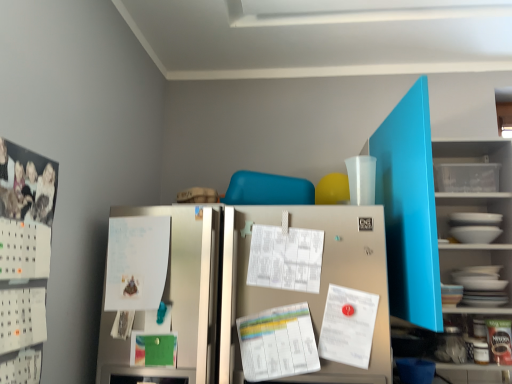
What are the coordinates of `white paper at center, the 2th paper from the left` in the screenshot? It's located at (285, 258).

I want to click on white paperboard at left, so click(x=24, y=258).

What do you see at coordinates (473, 258) in the screenshot? I see `white glossy bowls at right` at bounding box center [473, 258].

Describe the element at coordinates (348, 326) in the screenshot. I see `white paper at center, placed as the 3th paper when sorted from left to right` at that location.

Where is `satin silver refrigerator at center`? The image size is (512, 384). satin silver refrigerator at center is located at coordinates (257, 289).

Is white paper at center, the 2th paper from the left, next to satin silver refrigerator at center and touching it?

No, white paper at center, the 2th paper from the left, is not making contact with satin silver refrigerator at center.

Based on the photo, how much distance is there between white paper at center, which appears as the second paper when viewed from the right, and satin silver refrigerator at center?

A distance of 5.33 inches exists between white paper at center, which appears as the second paper when viewed from the right, and satin silver refrigerator at center.

Between white paper at center, the 2th paper from the left, and satin silver refrigerator at center, which one appears on the right side from the viewer's perspective?

Positioned to the right is white paper at center, the 2th paper from the left.

From a real-world perspective, which object stands above the other?

white paper at center, the 2th paper from the left, from a real-world perspective.

From the image's perspective, would you say satin silver refrigerator at center is positioned over white paperboard at left?

No, from the image's perspective, satin silver refrigerator at center is not over white paperboard at left.

Between satin silver refrigerator at center and white paperboard at left, which one has less height?

white paperboard at left is shorter.

In the image, is satin silver refrigerator at center positioned in front of or behind white paperboard at left?

satin silver refrigerator at center is positioned farther from the viewer than white paperboard at left.

How distant is satin silver refrigerator at center from white paperboard at left?

satin silver refrigerator at center is 19.11 inches away from white paperboard at left.

This screenshot has width=512, height=384. In order to click on bulletin board that is on the left side of matte blue bookshelf at upper right in this screenshot , I will do `click(24, 258)`.

Can you tell me how much white paperboard at left and matte blue bookshelf at upper right differ in facing direction?

90.2 degrees.

Considering the positions of objects white paperboard at left and matte blue bookshelf at upper right in the image provided, who is more to the right, white paperboard at left or matte blue bookshelf at upper right?

Positioned to the right is matte blue bookshelf at upper right.

In the scene shown: Is white paperboard at left touching matte blue bookshelf at upper right?

white paperboard at left and matte blue bookshelf at upper right are not in contact.

Does white paper at center, which appears as the 3th paper when viewed from the right, turn towards white paperboard at left?

Yes, white paper at center, which appears as the 3th paper when viewed from the right, is turned towards white paperboard at left.

Considering the relative sizes of white paper at center, which appears as the 3th paper when viewed from the right, and white paperboard at left in the image provided, is white paper at center, which appears as the 3th paper when viewed from the right, wider than white paperboard at left?

Indeed, white paper at center, which appears as the 3th paper when viewed from the right, has a greater width compared to white paperboard at left.

Does white paper at center, which appears as the 3th paper when viewed from the right, have a larger size compared to white paperboard at left?

Incorrect, white paper at center, which appears as the 3th paper when viewed from the right, is not larger than white paperboard at left.

Does matte blue bookshelf at upper right have a lesser width compared to satin silver refrigerator at center?

In fact, matte blue bookshelf at upper right might be wider than satin silver refrigerator at center.

Looking at the image, does matte blue bookshelf at upper right seem bigger or smaller compared to satin silver refrigerator at center?

In the image, matte blue bookshelf at upper right appears to be smaller than satin silver refrigerator at center.

Considering their positions, is matte blue bookshelf at upper right located in front of or behind satin silver refrigerator at center?

matte blue bookshelf at upper right is positioned closer to the viewer than satin silver refrigerator at center.

Is matte blue bookshelf at upper right not within satin silver refrigerator at center?

Indeed, matte blue bookshelf at upper right is completely outside satin silver refrigerator at center.

From a real-world perspective, between satin silver refrigerator at center and white glossy bowls at right, who is vertically higher?

white glossy bowls at right.

Consider the image. Can you confirm if satin silver refrigerator at center is taller than white glossy bowls at right?

Answer: Yes, satin silver refrigerator at center is taller than white glossy bowls at right.

Is satin silver refrigerator at center inside the boundaries of white glossy bowls at right, or outside?

satin silver refrigerator at center is not enclosed by white glossy bowls at right.

Is there a large distance between satin silver refrigerator at center and white glossy bowls at right?

satin silver refrigerator at center is actually quite close to white glossy bowls at right.

Consider the image. Considering the sizes of white paper at center, the 2th paper from the left, and white paper at center, which appears as the 3th paper when viewed from the right, in the image, is white paper at center, the 2th paper from the left, wider or thinner than white paper at center, which appears as the 3th paper when viewed from the right,?

Considering their sizes, white paper at center, the 2th paper from the left, looks slimmer than white paper at center, which appears as the 3th paper when viewed from the right.

Is white paper at center, which appears as the second paper when viewed from the right, at the left side of white paper at center, the 1th paper in the left-to-right sequence?

No.

Is white paper at center, which appears as the second paper when viewed from the right, positioned with its back to white paper at center, which appears as the 3th paper when viewed from the right?

That's not correct — white paper at center, which appears as the second paper when viewed from the right, is not looking away from white paper at center, which appears as the 3th paper when viewed from the right.

Does white paper at center, the 2th paper from the left, have a smaller size compared to white paper at center, the 1th paper in the left-to-right sequence?

Yes, white paper at center, the 2th paper from the left, is smaller than white paper at center, the 1th paper in the left-to-right sequence.

Locate an element on the screen. The image size is (512, 384). the 3rd paper above the satin silver refrigerator at center (from the image's perspective) is located at coordinates [x=285, y=258].

Where is `refrigerator located behind the white paperboard at left`? The height and width of the screenshot is (384, 512). refrigerator located behind the white paperboard at left is located at coordinates (x=257, y=289).

Looking at the image, which one is located closer to white paper at center, marked as the first paper in a right-to-left arrangement, white paper at center, the 2th paper from the left, or satin silver refrigerator at center?

Based on the image, white paper at center, the 2th paper from the left, appears to be nearer to white paper at center, marked as the first paper in a right-to-left arrangement.

Based on their spatial positions, is white paperboard at left or white glossy bowls at right further from white paper at center, placed as the 3th paper when sorted from left to right?

white paperboard at left is positioned further to the anchor white paper at center, placed as the 3th paper when sorted from left to right.

From the image, which object appears to be nearer to white paperboard at left, white paper at center, which appears as the second paper when viewed from the right, or satin silver refrigerator at center?

satin silver refrigerator at center lies closer to white paperboard at left than the other object.

Estimate the real-world distances between objects in this image. Which object is closer to white paper at center, placed as the 3th paper when sorted from left to right, white glossy bowls at right or satin silver refrigerator at center?

Based on the image, satin silver refrigerator at center appears to be nearer to white paper at center, placed as the 3th paper when sorted from left to right.

Based on the photo, based on their spatial positions, is satin silver refrigerator at center or white paper at center, which appears as the second paper when viewed from the right, further from white glossy bowls at right?

Based on the image, satin silver refrigerator at center appears to be further to white glossy bowls at right.

Based on their spatial positions, is white glossy bowls at right or white paperboard at left further from white paper at center, marked as the first paper in a right-to-left arrangement?

white paperboard at left is positioned further to the anchor white paper at center, marked as the first paper in a right-to-left arrangement.

Which object lies nearer to the anchor point matte blue bookshelf at upper right, white paper at center, the 2th paper from the left, or satin silver refrigerator at center?

Based on the image, white paper at center, the 2th paper from the left, appears to be nearer to matte blue bookshelf at upper right.

Looking at the image, which one is located further to white paper at center, which appears as the second paper when viewed from the right, satin silver refrigerator at center or white paperboard at left?

white paperboard at left.

You are a GUI agent. You are given a task and a screenshot of the screen. Output one action in this format:
    pyautogui.click(x=<x>, y=<y>)
    Task: Click on the bookshelf situated between white paper at center, which appears as the second paper when viewed from the right, and white glossy bowls at right from left to right
    This screenshot has height=384, width=512.
    Given the screenshot: What is the action you would take?
    pyautogui.click(x=431, y=209)

Where is `bookshelf between white paper at center, which appears as the 3th paper when viewed from the right, and white glossy bowls at right, in the horizontal direction`? The height and width of the screenshot is (384, 512). bookshelf between white paper at center, which appears as the 3th paper when viewed from the right, and white glossy bowls at right, in the horizontal direction is located at coordinates (431, 209).

Where is `paper located between satin silver refrigerator at center and white paper at center, placed as the 3th paper when sorted from left to right, in the left-right direction`? paper located between satin silver refrigerator at center and white paper at center, placed as the 3th paper when sorted from left to right, in the left-right direction is located at coordinates (285, 258).

At what (x,y) coordinates should I click in order to perform the action: click on bookshelf located between satin silver refrigerator at center and white glossy bowls at right in the left-right direction. Please return your answer as a coordinate pair (x, y). This screenshot has height=384, width=512. Looking at the image, I should click on (431, 209).